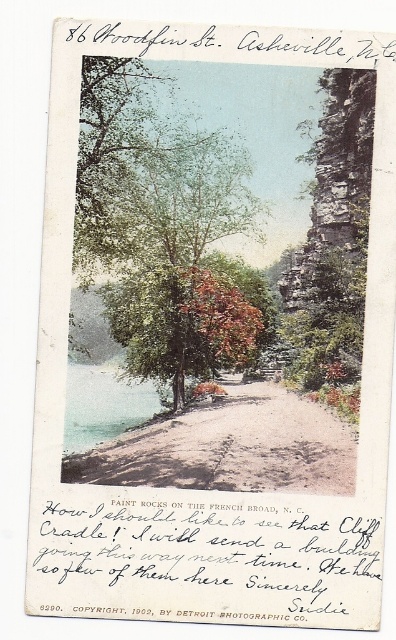
Question: Is green leafy tree at center above sandy dirt path at center?

Choices:
 (A) no
 (B) yes

Answer: (B)

Question: Which point is closer to the camera taking this photo?

Choices:
 (A) (127, 392)
 (B) (190, 230)

Answer: (A)

Question: Does green leafy tree at center have a smaller size compared to sandy dirt path at center?

Choices:
 (A) no
 (B) yes

Answer: (A)

Question: Which point appears farthest from the camera in this image?

Choices:
 (A) (249, 467)
 (B) (102, 172)

Answer: (B)

Question: Is green leafy tree at center to the right of sandy dirt path at center from the viewer's perspective?

Choices:
 (A) no
 (B) yes

Answer: (A)